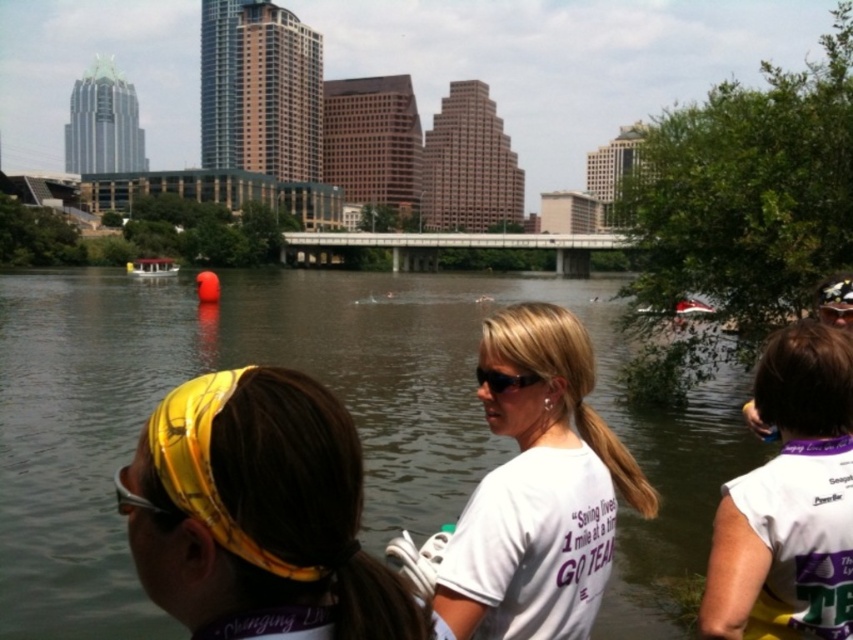
Question: Which object is closer to the camera taking this photo?

Choices:
 (A) greenish water at center
 (B) gold plastic goggles at lower left
 (C) white matte t-shirt at center
 (D) yellow printed bandana at upper left

Answer: (D)

Question: Is the position of white matte t-shirt at center less distant than that of sunglasses at center?

Choices:
 (A) yes
 (B) no

Answer: (A)

Question: Does yellow printed bandana at upper left have a lesser width compared to white matte t-shirt at center?

Choices:
 (A) yes
 (B) no

Answer: (A)

Question: Which object is the closest to the white plastic boat at upper right?

Choices:
 (A) greenish water at center
 (B) white matte t-shirt at center

Answer: (A)

Question: Which point appears farthest from the camera in this image?

Choices:
 (A) (509, 630)
 (B) (154, 506)

Answer: (A)

Question: Does greenish water at center appear on the left side of sunglasses at center?

Choices:
 (A) yes
 (B) no

Answer: (A)